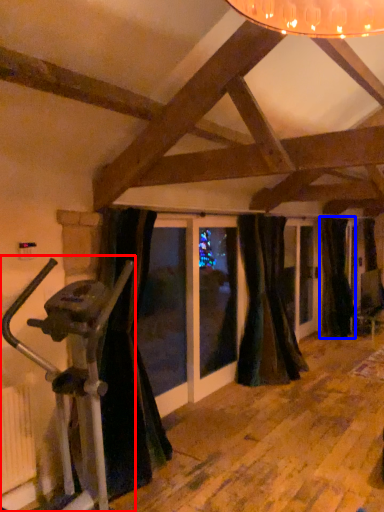
Question: Which point is closer to the camera, stationary bicycle (highlighted by a red box) or curtain (highlighted by a blue box)?

Choices:
 (A) stationary bicycle
 (B) curtain

Answer: (A)